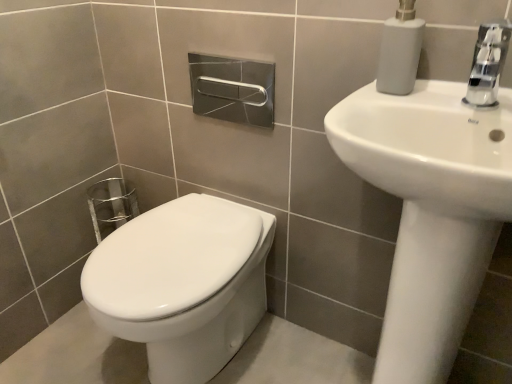
Where is `vacant area that lies in front of white matte soap dispenser at upper right`? The image size is (512, 384). vacant area that lies in front of white matte soap dispenser at upper right is located at coordinates pos(400,101).